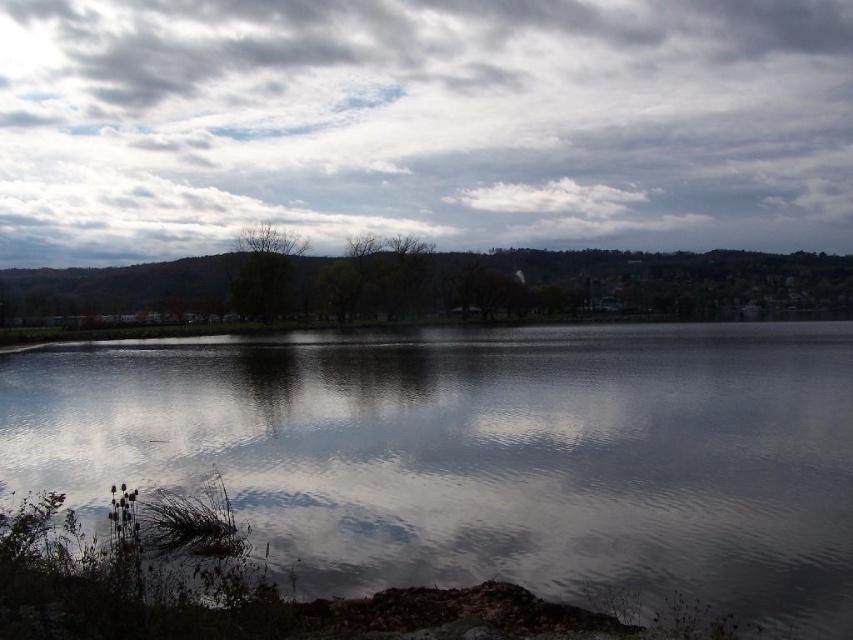
You are an artist trying to paint the scene. You notice the cloudy sky at upper center and the glossy reflective water at center. Which object is positioned to the right side of the other?

The cloudy sky at upper center is positioned to the right of the glossy reflective water at center.

You are standing at the lakeside and want to take a photo of the green matte tree at center and the glossy reflective water at center. Which object should you focus on first if you want both to be in sharp focus?

You should focus on the green matte tree at center first because it is closer to you than the glossy reflective water at center, which is further away. By focusing on the closer object, the background object will also be in focus due to the depth of field.

You are standing at the lakeside and looking towards the center of the image. Which object, the cloudy sky at upper center or the green matte tree at center, is closer to you?

The green matte tree at center is behind the cloudy sky at upper center, so the cloudy sky at upper center is closer to you.